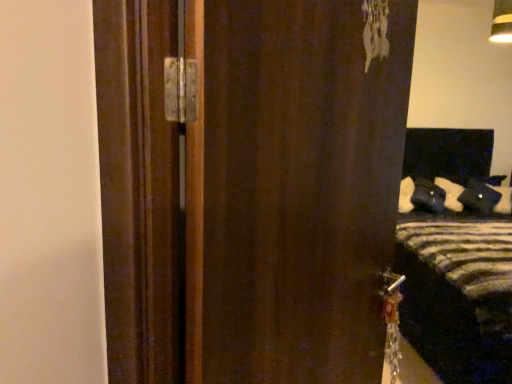
Question: Is striped fabric bed at right not close to brown matte door at center?

Choices:
 (A) yes
 (B) no

Answer: (A)

Question: Does striped fabric bed at right have a smaller size compared to brown matte door at center?

Choices:
 (A) yes
 (B) no

Answer: (B)

Question: Does striped fabric bed at right appear on the right side of brown matte door at center?

Choices:
 (A) yes
 (B) no

Answer: (A)

Question: Is striped fabric bed at right turned away from brown matte door at center?

Choices:
 (A) yes
 (B) no

Answer: (B)

Question: From the image's perspective, is striped fabric bed at right on top of brown matte door at center?

Choices:
 (A) yes
 (B) no

Answer: (B)

Question: Is brown matte door at center surrounded by striped fabric bed at right?

Choices:
 (A) no
 (B) yes

Answer: (A)

Question: Can you confirm if brown matte door at center is shorter than striped fabric bed at right?

Choices:
 (A) no
 (B) yes

Answer: (B)

Question: Does brown matte door at center appear on the left side of striped fabric bed at right?

Choices:
 (A) no
 (B) yes

Answer: (B)

Question: Is brown matte door at center smaller than striped fabric bed at right?

Choices:
 (A) no
 (B) yes

Answer: (B)

Question: Considering the relative sizes of brown matte door at center and striped fabric bed at right in the image provided, is brown matte door at center bigger than striped fabric bed at right?

Choices:
 (A) yes
 (B) no

Answer: (B)

Question: Is the position of brown matte door at center more distant than that of striped fabric bed at right?

Choices:
 (A) yes
 (B) no

Answer: (B)

Question: Is brown matte door at center not close to striped fabric bed at right?

Choices:
 (A) no
 (B) yes

Answer: (B)

Question: From the image's perspective, is brown matte door at center located above or below striped fabric bed at right?

Choices:
 (A) above
 (B) below

Answer: (A)